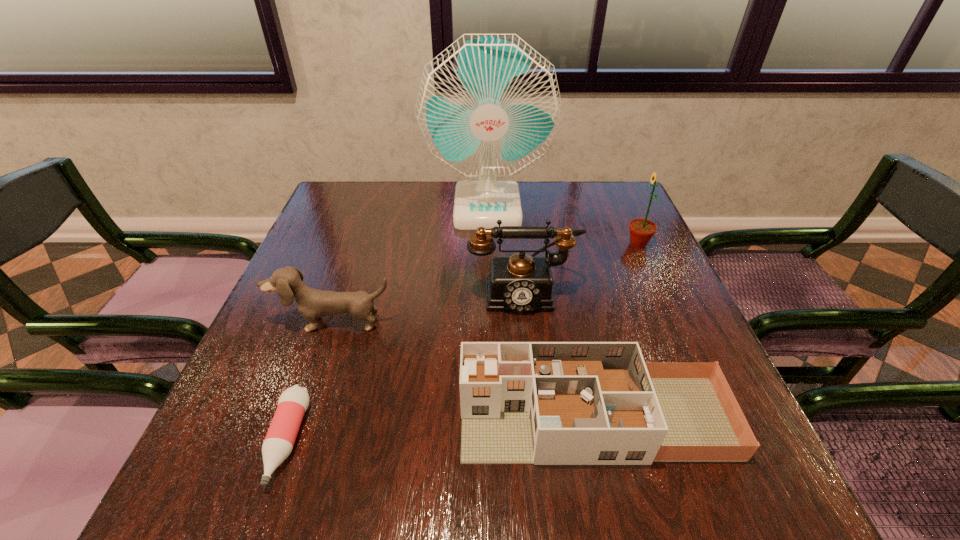
Find the location of a particular element. vacant area that lies between the fifth nearest object and the farthest object is located at coordinates (563, 226).

This screenshot has width=960, height=540. In order to click on vacant space that's between the tallest object and the shortest object in this screenshot , I will do `click(387, 324)`.

The image size is (960, 540). Find the location of `free space between the dollhouse and the farthest object`. free space between the dollhouse and the farthest object is located at coordinates (540, 313).

At what (x,y) coordinates should I click in order to perform the action: click on free spot between the telephone and the fifth nearest object. Please return your answer as a coordinate pair (x, y). The image size is (960, 540). Looking at the image, I should click on (580, 268).

The image size is (960, 540). Find the location of `vacant space in between the telephone and the second farthest object`. vacant space in between the telephone and the second farthest object is located at coordinates (580, 268).

Locate an element on the screen. The width and height of the screenshot is (960, 540). object that can be found as the fifth closest to the sunflower is located at coordinates (279, 441).

Select which object appears as the second closest to the telephone. Please provide its 2D coordinates. Your answer should be formatted as a tuple, i.e. [(x, y)], where the tuple contains the x and y coordinates of a point satisfying the conditions above.

[(545, 403)]

I want to click on free location that satisfies the following two spatial constraints: 1. at the front door of the fifth tallest object; 2. with the cap open on the bottle, so click(599, 441).

In order to click on free location that satisfies the following two spatial constraints: 1. on the face of the sunflower; 2. with the cap open on the shortest object in this screenshot , I will do `click(727, 441)`.

I want to click on vacant area in the image that satisfies the following two spatial constraints: 1. on the face of the fifth nearest object; 2. at the face of the third shortest object, so click(673, 323).